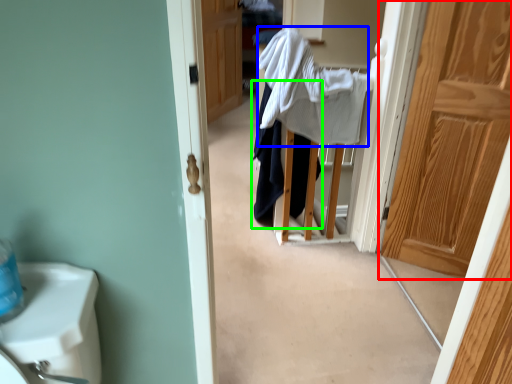
Question: Based on their relative distances, which object is nearer to door (highlighted by a red box)? Choose from bath towel (highlighted by a blue box) and clothing (highlighted by a green box).

Choices:
 (A) bath towel
 (B) clothing

Answer: (A)